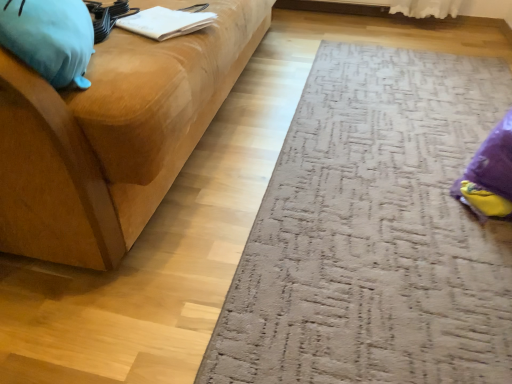
Question: From a real-world perspective, is white paper at upper left beneath textured gray doormat at lower right?

Choices:
 (A) yes
 (B) no

Answer: (B)

Question: Can you confirm if white paper at upper left is smaller than textured gray doormat at lower right?

Choices:
 (A) no
 (B) yes

Answer: (B)

Question: Can you confirm if white paper at upper left is wider than textured gray doormat at lower right?

Choices:
 (A) yes
 (B) no

Answer: (B)

Question: Is white paper at upper left turned away from textured gray doormat at lower right?

Choices:
 (A) no
 (B) yes

Answer: (A)

Question: From the image's perspective, does white paper at upper left appear lower than textured gray doormat at lower right?

Choices:
 (A) yes
 (B) no

Answer: (B)

Question: Considering the positions of white paper at upper left and textured gray doormat at lower right in the image, is white paper at upper left taller or shorter than textured gray doormat at lower right?

Choices:
 (A) short
 (B) tall

Answer: (B)

Question: Is point (131, 18) closer or farther from the camera than point (466, 86)?

Choices:
 (A) farther
 (B) closer

Answer: (B)

Question: In terms of width, does white paper at upper left look wider or thinner when compared to textured gray doormat at lower right?

Choices:
 (A) thin
 (B) wide

Answer: (A)

Question: Relative to textured gray doormat at lower right, is white paper at upper left in front or behind?

Choices:
 (A) front
 (B) behind

Answer: (B)

Question: Considering the positions of textured gray doormat at lower right and soft blue plush at left in the image, is textured gray doormat at lower right wider or thinner than soft blue plush at left?

Choices:
 (A) wide
 (B) thin

Answer: (A)

Question: In terms of size, does textured gray doormat at lower right appear bigger or smaller than soft blue plush at left?

Choices:
 (A) small
 (B) big

Answer: (B)

Question: From the image's perspective, is textured gray doormat at lower right located above or below soft blue plush at left?

Choices:
 (A) above
 (B) below

Answer: (B)

Question: In the image, is textured gray doormat at lower right positioned in front of or behind soft blue plush at left?

Choices:
 (A) behind
 (B) front

Answer: (A)

Question: In the image, is matte wood studio couch at left positioned in front of or behind textured gray doormat at lower right?

Choices:
 (A) behind
 (B) front

Answer: (B)

Question: From a real-world perspective, is matte wood studio couch at left positioned above or below textured gray doormat at lower right?

Choices:
 (A) below
 (B) above

Answer: (B)